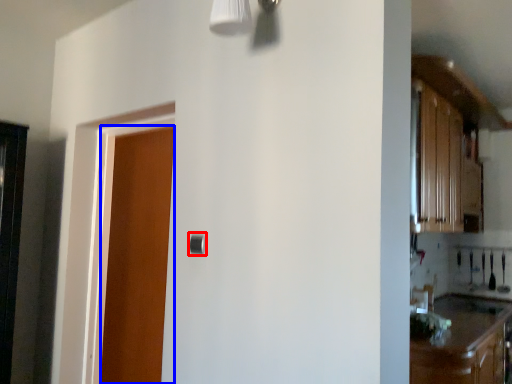
Question: Which of the following is the farthest to the observer, door handle (highlighted by a red box) or door (highlighted by a blue box)?

Choices:
 (A) door handle
 (B) door

Answer: (B)